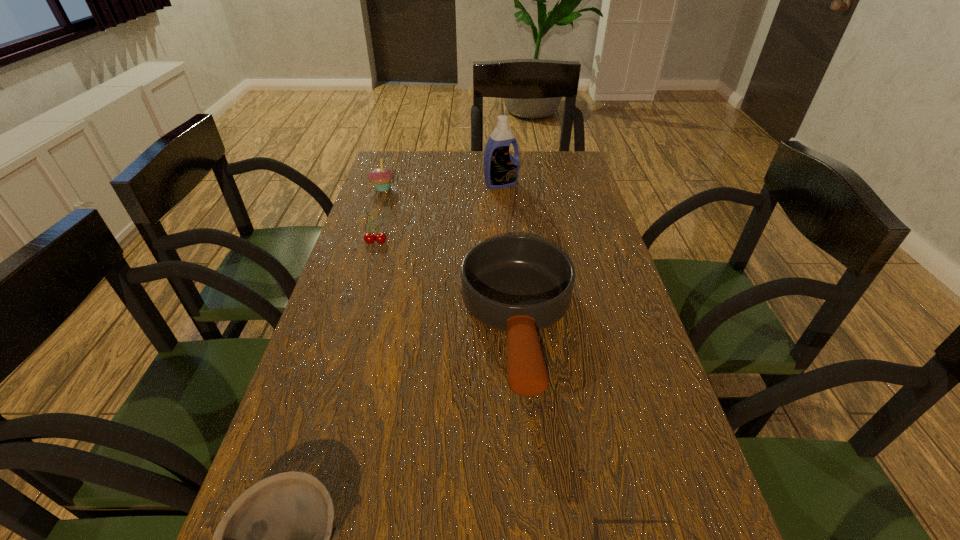
This screenshot has width=960, height=540. I want to click on the third closest object to the third farthest object, so [501, 170].

Where is `vacant space that satisfies the following two spatial constraints: 1. on the back side of the tallest object; 2. on the right side of the cupcake`? This screenshot has width=960, height=540. vacant space that satisfies the following two spatial constraints: 1. on the back side of the tallest object; 2. on the right side of the cupcake is located at coordinates (384, 184).